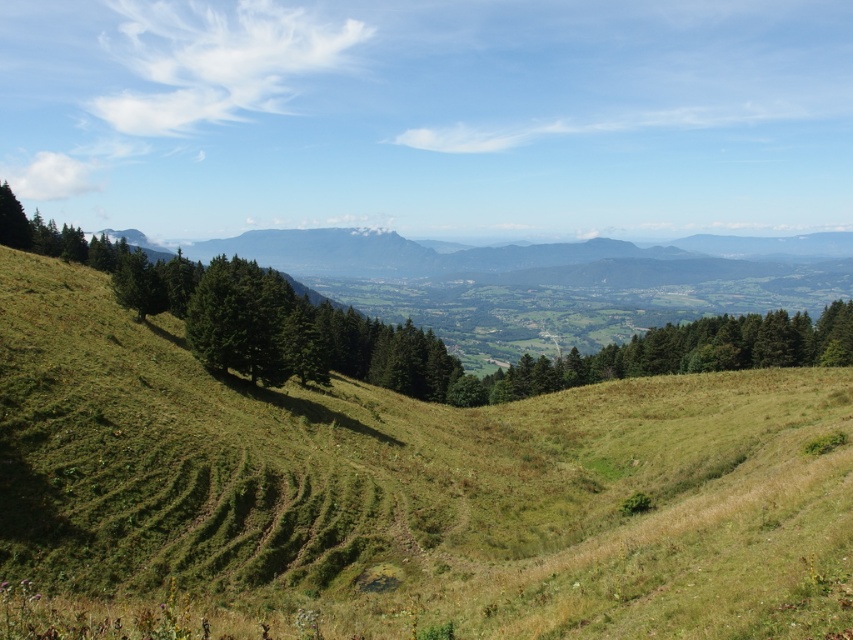
Does green grassy hillside at center appear under green matte tree at left?

Correct, green grassy hillside at center is located below green matte tree at left.

Which is more to the left, green grassy hillside at center or green matte tree at left?

green grassy hillside at center is more to the left.

Where is `green grassy hillside at center`? green grassy hillside at center is located at coordinates (410, 488).